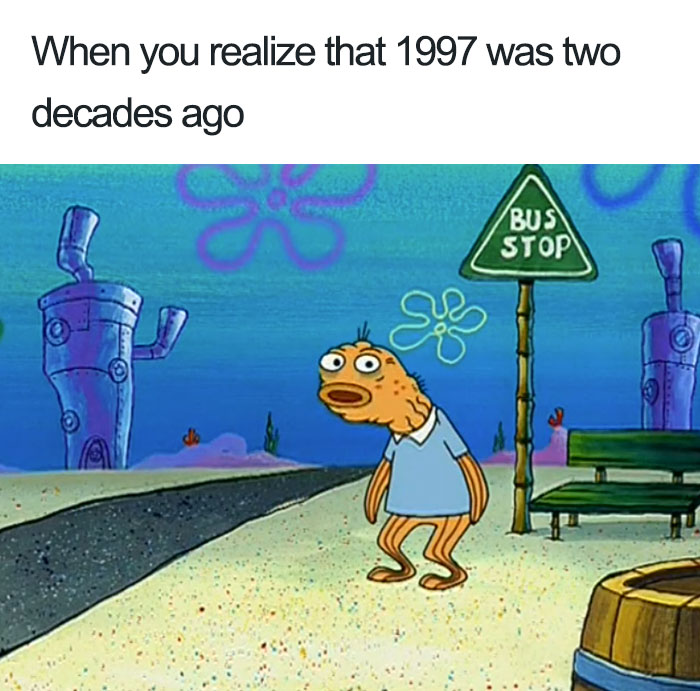
You are a GUI agent. You are given a task and a screenshot of the screen. Output one action in this format:
    pyautogui.click(x=<x>, y=<y>)
    Task: Click on the front bench leg
    
    Given the screenshot: What is the action you would take?
    pyautogui.click(x=671, y=524), pyautogui.click(x=554, y=527)